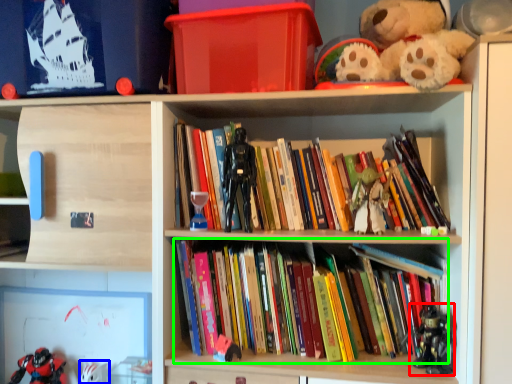
Question: Which object is positioned closest to toy (highlighted by a red box)? Select from toy (highlighted by a blue box) and book (highlighted by a green box).

Choices:
 (A) toy
 (B) book

Answer: (B)